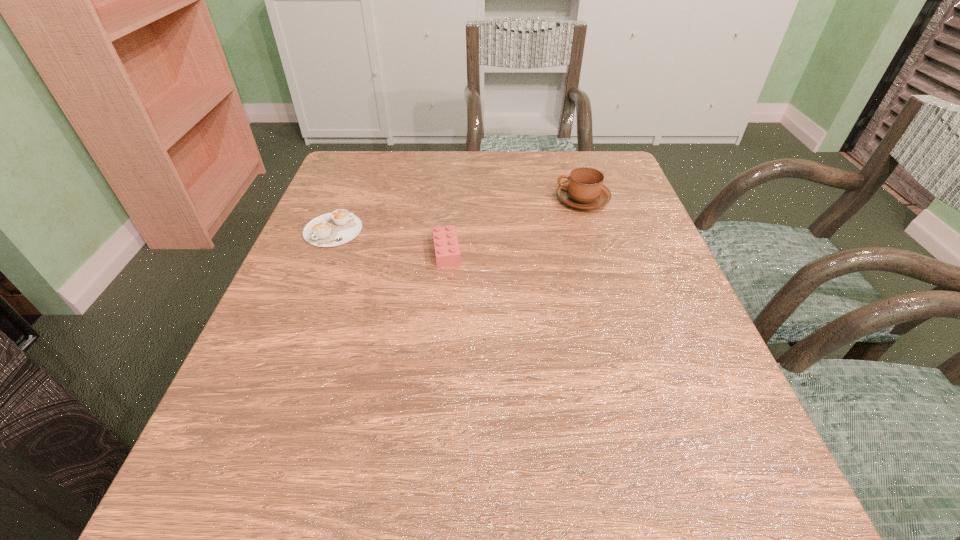
At what (x,y) coordinates should I click in order to perform the action: click on free space at the far right corner of the desktop. Please return your answer as a coordinate pair (x, y). The height and width of the screenshot is (540, 960). Looking at the image, I should click on (588, 151).

Where is `vacant space at the near right corner of the desktop`? This screenshot has height=540, width=960. vacant space at the near right corner of the desktop is located at coordinates (661, 518).

You are a GUI agent. You are given a task and a screenshot of the screen. Output one action in this format:
    pyautogui.click(x=<x>, y=<y>)
    Task: Click on the free space between the left cappuccino and the second object from right to left
    The width and height of the screenshot is (960, 540).
    Given the screenshot: What is the action you would take?
    pyautogui.click(x=390, y=241)

What are the coordinates of `unoccupied area between the left cappuccino and the second object from right to left` in the screenshot? It's located at (390, 241).

At what (x,y) coordinates should I click in order to perform the action: click on free spot between the second shortest object and the left cappuccino. Please return your answer as a coordinate pair (x, y). This screenshot has width=960, height=540. Looking at the image, I should click on tap(390, 241).

Locate an element on the screen. free area in between the shortest object and the rightmost object is located at coordinates (458, 215).

I want to click on empty space that is in between the second object from right to left and the leftmost object, so click(x=390, y=241).

You are a GUI agent. You are given a task and a screenshot of the screen. Output one action in this format:
    pyautogui.click(x=<x>, y=<y>)
    Task: Click on the vacant point located between the second shortest object and the shortest object
    The height and width of the screenshot is (540, 960).
    Given the screenshot: What is the action you would take?
    pyautogui.click(x=390, y=241)

Identify the location of free space between the shortest object and the second object from left to right. (390, 241).

Where is `free area in between the second object from right to left and the leftmost object`? free area in between the second object from right to left and the leftmost object is located at coordinates (390, 241).